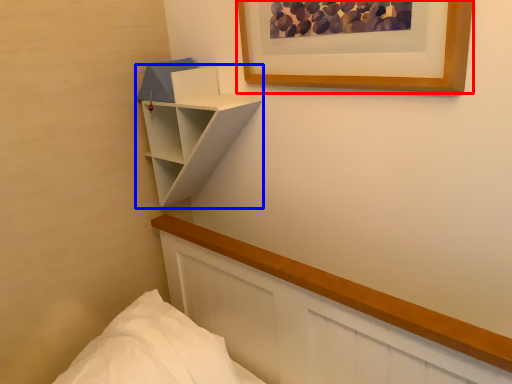
Question: Which object is closer to the camera taking this photo, picture frame (highlighted by a red box) or shelf (highlighted by a blue box)?

Choices:
 (A) picture frame
 (B) shelf

Answer: (A)